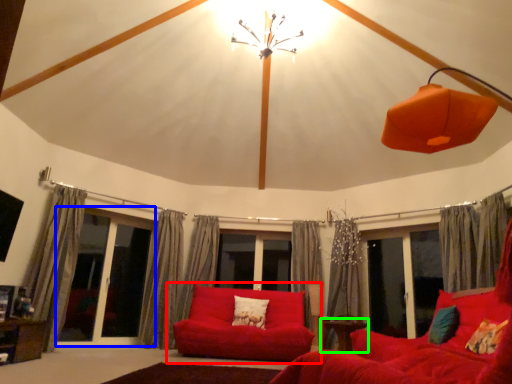
Question: Estimate the real-world distances between objects in this image. Which object is closer to studio couch (highlighted by a red box), screen door (highlighted by a blue box) or table (highlighted by a green box)?

Choices:
 (A) screen door
 (B) table

Answer: (B)